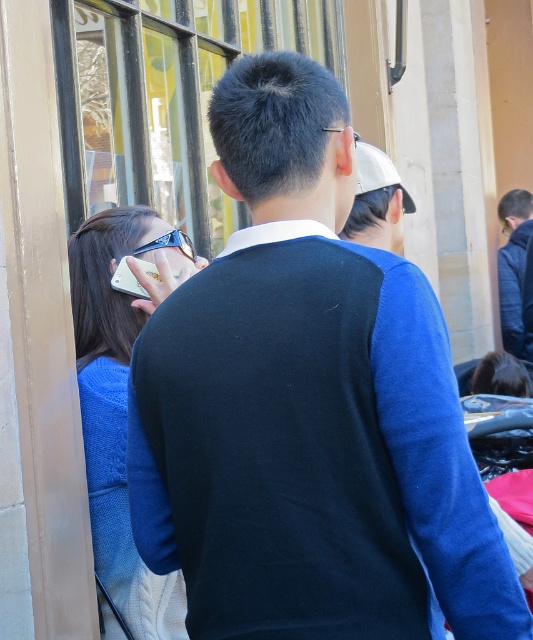
Who is more forward, (x=138, y=243) or (x=130, y=275)?

Positioned in front is point (x=138, y=243).

Which is behind, point (95, 320) or point (119, 266)?

Point (95, 320)

The image size is (533, 640). I want to click on satin blue sweater at left, so click(x=118, y=404).

Who is higher up, blue knit sweater at center or satin blue sweater at left?

blue knit sweater at center is higher up.

Is blue knit sweater at center closer to the viewer compared to satin blue sweater at left?

Yes.

Which is behind, point (415, 429) or point (125, 324)?

The point (125, 324) is more distant.

Where is `blue knit sweater at center`? This screenshot has width=533, height=640. blue knit sweater at center is located at coordinates (308, 406).

Is blue knit sweater at center to the right of white matte cap at upper center from the viewer's perspective?

Incorrect, blue knit sweater at center is not on the right side of white matte cap at upper center.

Does blue knit sweater at center appear under white matte cap at upper center?

Correct, blue knit sweater at center is located below white matte cap at upper center.

Where is `blue knit sweater at center`? This screenshot has height=640, width=533. blue knit sweater at center is located at coordinates (308, 406).